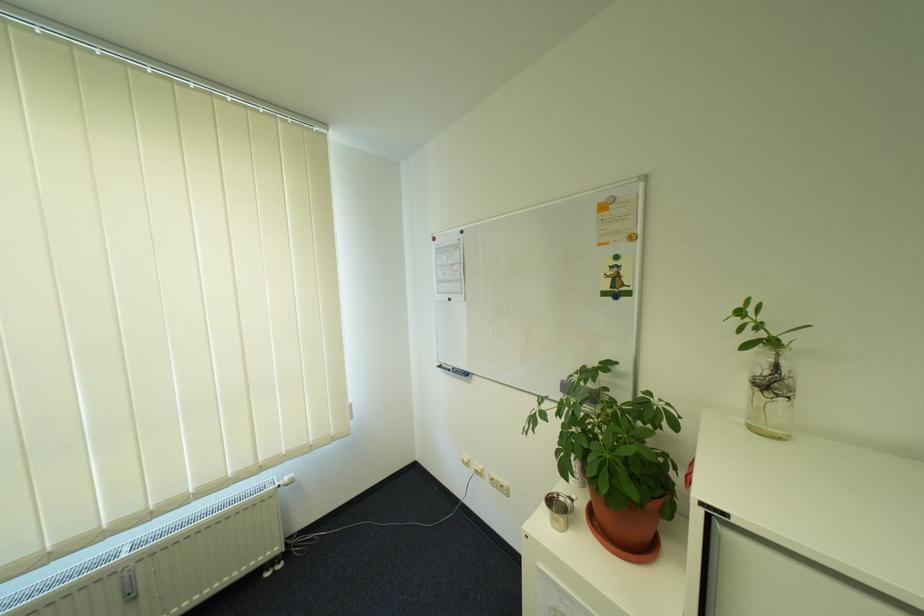
Find where to lift the yellow round magnet. Please return your answer as a coordinate pair (x, y).

(631, 237)